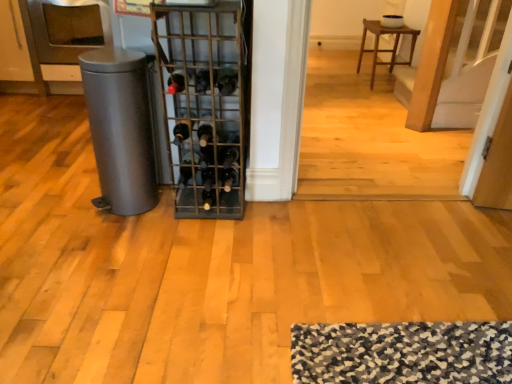
Locate an element on the screen. The height and width of the screenshot is (384, 512). vacant area on top of brown wooden stool at upper center (from a real-world perspective) is located at coordinates (392, 26).